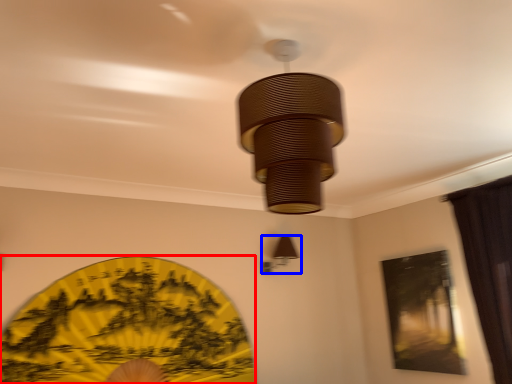
Question: Which point is closer to the camera, design (highlighted by a red box) or lamp (highlighted by a blue box)?

Choices:
 (A) design
 (B) lamp

Answer: (A)